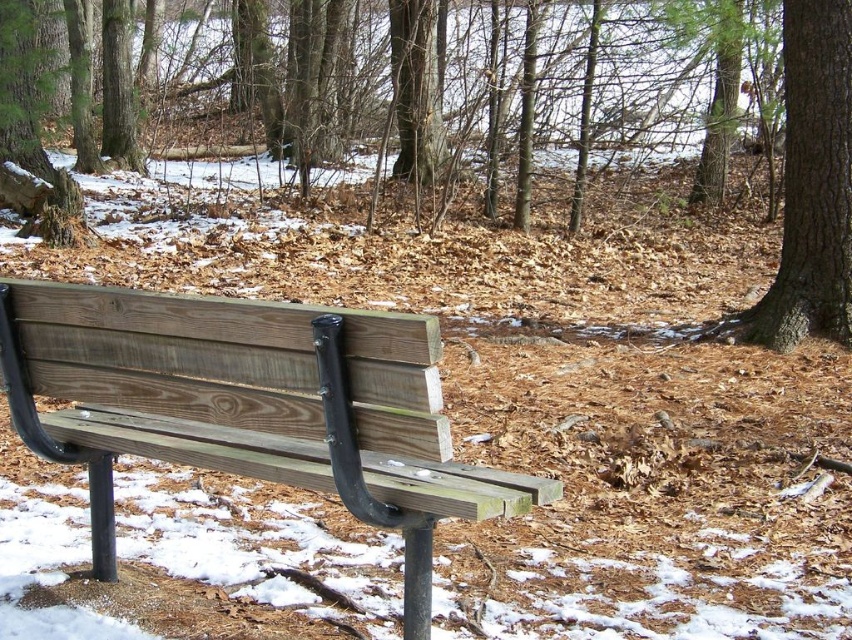
Question: Is wooden bench at center further to camera compared to brown rough bark tree at upper right?

Choices:
 (A) no
 (B) yes

Answer: (A)

Question: Among these points, which one is nearest to the camera?

Choices:
 (A) (778, 324)
 (B) (131, 352)

Answer: (B)

Question: Is wooden bench at center thinner than brown rough bark tree at upper right?

Choices:
 (A) no
 (B) yes

Answer: (A)

Question: Does wooden bench at center have a lesser width compared to brown rough bark tree at upper right?

Choices:
 (A) yes
 (B) no

Answer: (B)

Question: Which point appears farthest from the camera in this image?

Choices:
 (A) (263, 435)
 (B) (795, 163)

Answer: (B)